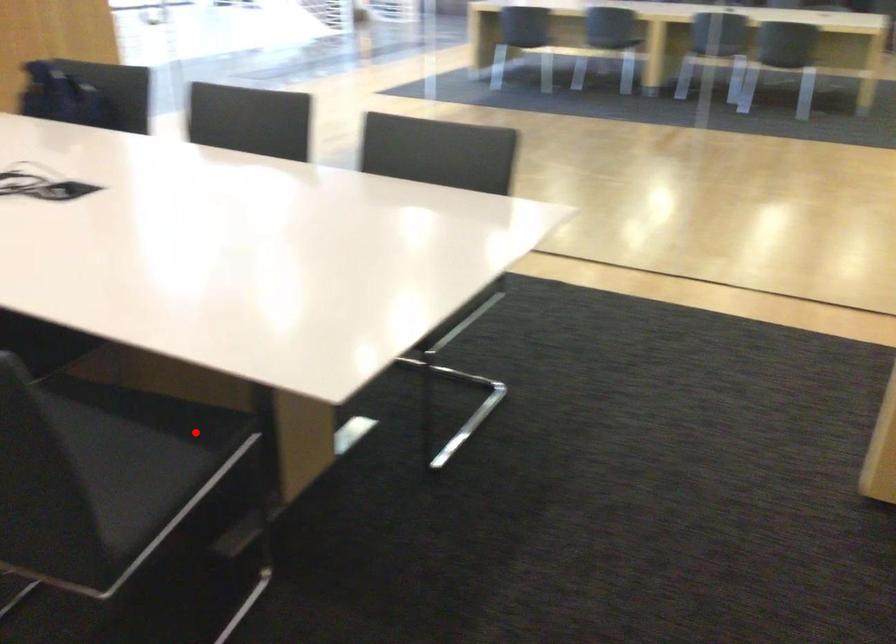
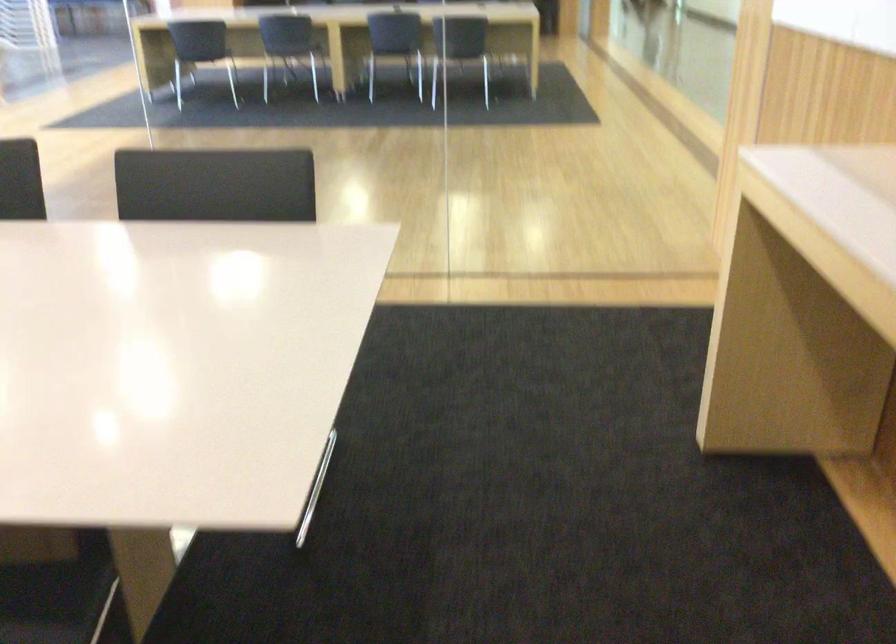
Where in the second image is the point corresponding to the highlighted location from the first image?

(55, 601)